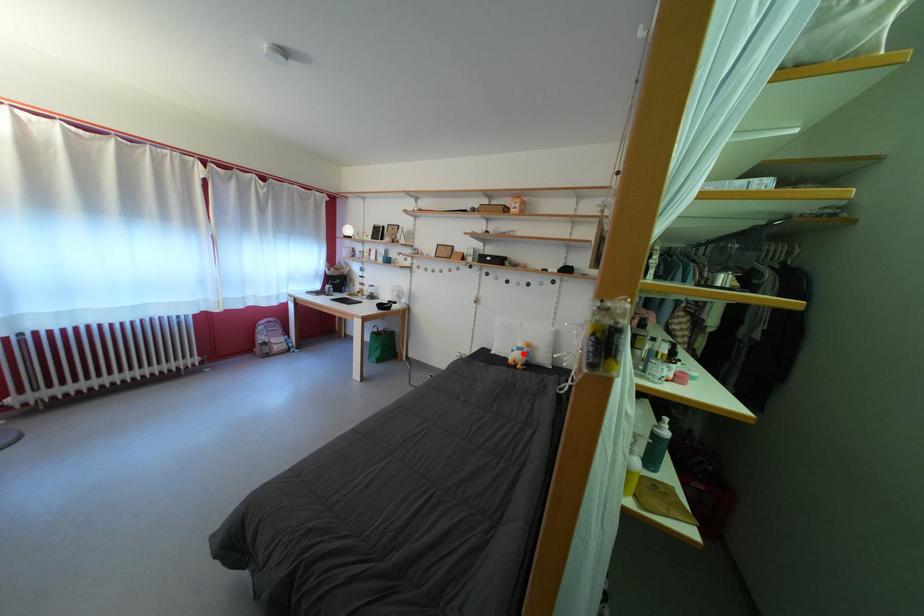
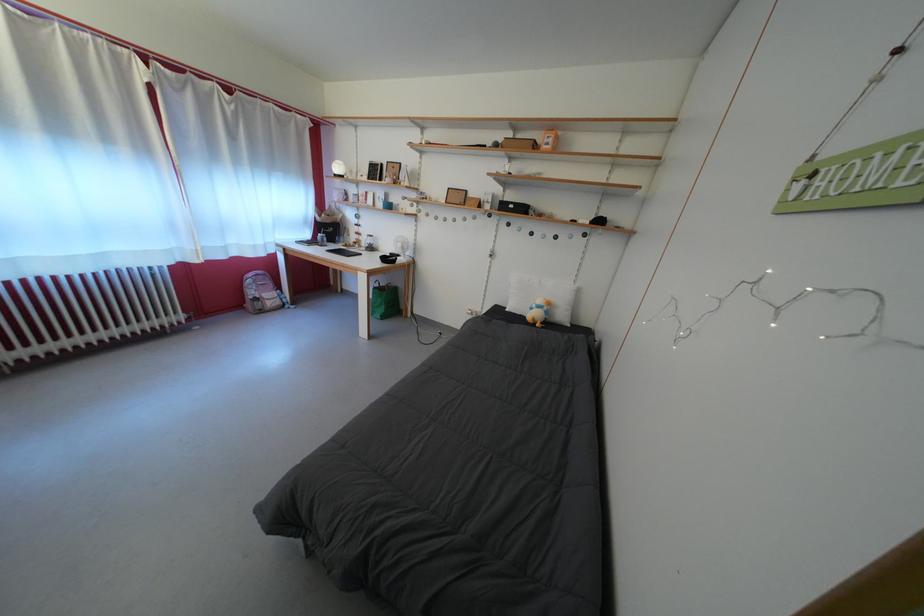
Question: I am providing you with two images of the same scene from different viewpoints. A red point is marked on the first image. Is the red point's position out of view in image 2?

Choices:
 (A) Yes
 (B) No

Answer: (B)